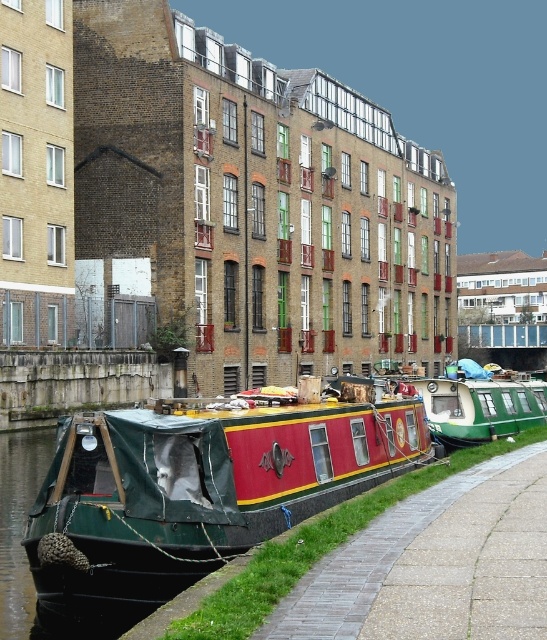
You are a delivery person trying to navigate a 2.5 meter wide delivery truck through the canal area. The green painted wooden barge at lower left and the paved concrete path at lower right are both potential routes. Based on their widths, which route can the truck safely pass through?

The green painted wooden barge at lower left is wider than the paved concrete path at lower right. Since the truck is 2.5 meters wide, it can only safely pass through the green painted wooden barge at lower left if its width is at least 2.5 meters. However, since the barge is wider than the path, but we donot know the exact width of the barge, we cannot determine the answer definitively.

Looking at this image, you are standing at the center of the canal and want to locate the green painted wooden barge at lower left. According to the coordinates provided, where should you look in relation to your position?

The green painted wooden barge at lower left is located at coordinates point 0.762 on the x axis and 0.371 on the y axis, so you should look to the lower left direction from your current position at the center of the canal.

You are a delivery person needing to transport a large package from the green painted wooden barge at lower left to the paved concrete path at lower right. Considering their sizes, which object can accommodate the package more comfortably?

The green painted wooden barge at lower left is bigger than the paved concrete path at lower right, so it can accommodate the large package more comfortably.